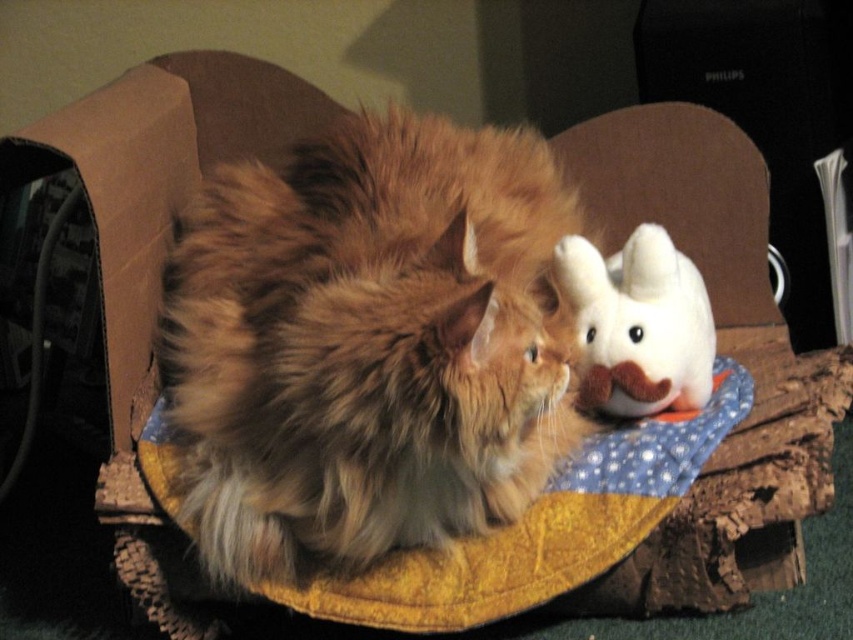
Question: Which of the following is the farthest from the observer?

Choices:
 (A) white plush toy at upper right
 (B) fuzzy brown cat at center

Answer: (A)

Question: Which of the following is the farthest from the observer?

Choices:
 (A) fuzzy brown cat at center
 (B) white plush toy at upper right

Answer: (B)

Question: Does fuzzy brown cat at center come in front of white plush toy at upper right?

Choices:
 (A) yes
 (B) no

Answer: (A)

Question: Can you confirm if fuzzy brown cat at center is positioned to the right of white plush toy at upper right?

Choices:
 (A) no
 (B) yes

Answer: (A)

Question: Does fuzzy brown cat at center appear on the left side of white plush toy at upper right?

Choices:
 (A) no
 (B) yes

Answer: (B)